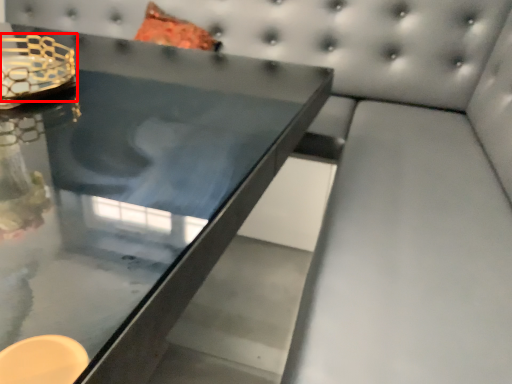
Question: From the image's perspective, where is candle holder (annotated by the red box) located in relation to table in the image?

Choices:
 (A) below
 (B) above

Answer: (B)